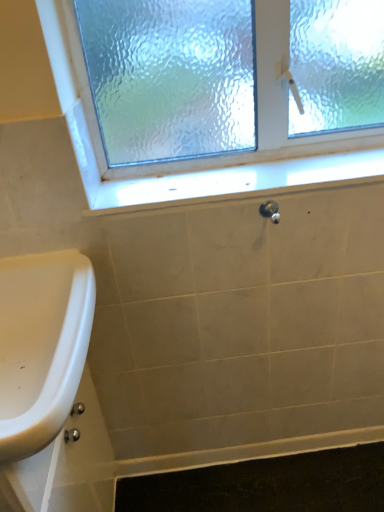
Question: Is white glossy window sill at center a part of satin nickel knob at center?

Choices:
 (A) yes
 (B) no

Answer: (B)

Question: Would you say satin nickel knob at center is a long distance from white glossy window sill at center?

Choices:
 (A) yes
 (B) no

Answer: (B)

Question: Considering the relative sizes of satin nickel knob at center and white glossy window sill at center in the image provided, is satin nickel knob at center shorter than white glossy window sill at center?

Choices:
 (A) no
 (B) yes

Answer: (A)

Question: Can you confirm if satin nickel knob at center is taller than white glossy window sill at center?

Choices:
 (A) yes
 (B) no

Answer: (A)

Question: Can you confirm if satin nickel knob at center is wider than white glossy window sill at center?

Choices:
 (A) yes
 (B) no

Answer: (B)

Question: Is satin nickel knob at center turned away from white glossy window sill at center?

Choices:
 (A) yes
 (B) no

Answer: (A)

Question: Is satin nickel knob at center with black rubber bath mat at lower center?

Choices:
 (A) no
 (B) yes

Answer: (A)

Question: From the image's perspective, is satin nickel knob at center below black rubber bath mat at lower center?

Choices:
 (A) no
 (B) yes

Answer: (A)

Question: Does satin nickel knob at center have a larger size compared to black rubber bath mat at lower center?

Choices:
 (A) no
 (B) yes

Answer: (A)

Question: Does satin nickel knob at center turn towards black rubber bath mat at lower center?

Choices:
 (A) yes
 (B) no

Answer: (B)

Question: From the image's perspective, is satin nickel knob at center on black rubber bath mat at lower center?

Choices:
 (A) no
 (B) yes

Answer: (B)

Question: Can you confirm if satin nickel knob at center is smaller than black rubber bath mat at lower center?

Choices:
 (A) no
 (B) yes

Answer: (B)

Question: Is white glossy sink at lower left wider than frosted glass window at upper center?

Choices:
 (A) yes
 (B) no

Answer: (A)